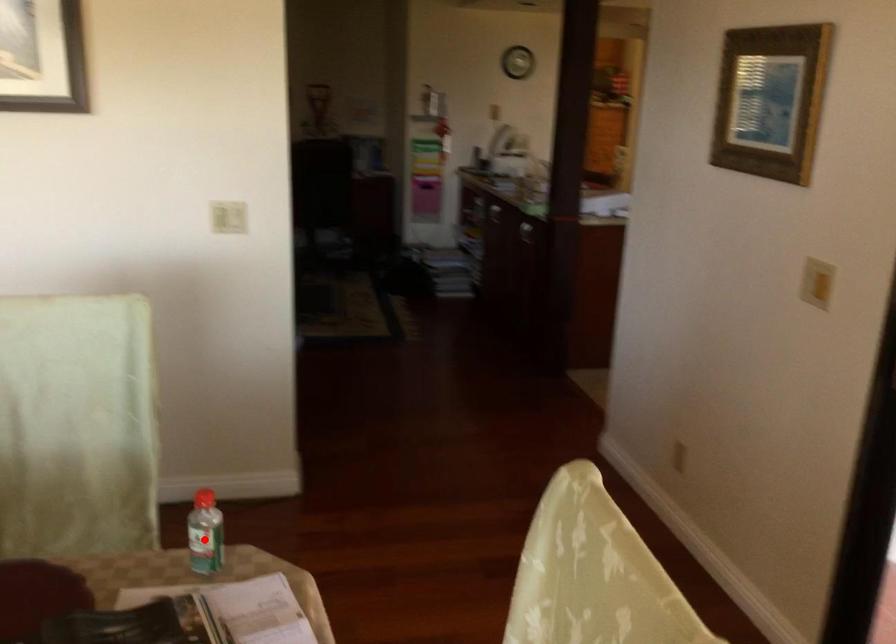
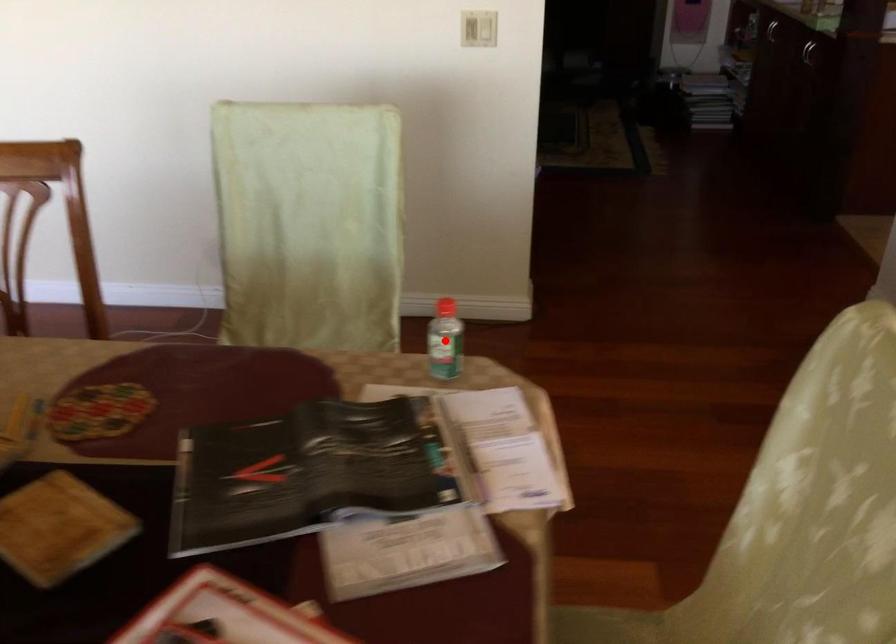
I am providing you with two images of the same scene from different viewpoints. A red point is marked on the first image and another point is marked on the second image. Is the red point in image1 aligned with the point shown in image2?

Yes